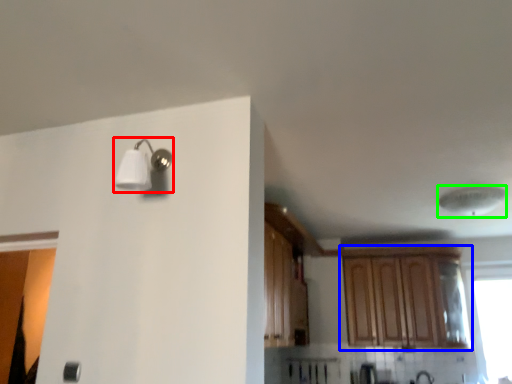
Question: Which object is the closest to the light fixture (highlighted by a red box)? Choose among these: cabinetry (highlighted by a blue box) or lamp (highlighted by a green box).

Choices:
 (A) cabinetry
 (B) lamp

Answer: (B)